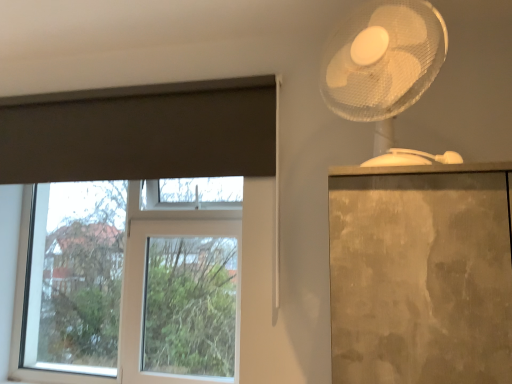
Question: Is white plastic fan at upper right completely or partially inside clear glass window at left?

Choices:
 (A) yes
 (B) no

Answer: (B)

Question: Is clear glass window at left to the left of white plastic fan at upper right from the viewer's perspective?

Choices:
 (A) yes
 (B) no

Answer: (A)

Question: Can you confirm if clear glass window at left is smaller than white plastic fan at upper right?

Choices:
 (A) yes
 (B) no

Answer: (B)

Question: Would you say clear glass window at left is a long distance from white plastic fan at upper right?

Choices:
 (A) yes
 (B) no

Answer: (A)

Question: Does clear glass window at left come behind white plastic fan at upper right?

Choices:
 (A) no
 (B) yes

Answer: (B)

Question: Considering their positions, is dark gray matte curtain at upper left located in front of or behind white plastic fan at upper right?

Choices:
 (A) front
 (B) behind

Answer: (B)

Question: Visually, is dark gray matte curtain at upper left positioned to the left or to the right of white plastic fan at upper right?

Choices:
 (A) right
 (B) left

Answer: (B)

Question: Is dark gray matte curtain at upper left inside the boundaries of white plastic fan at upper right, or outside?

Choices:
 (A) outside
 (B) inside

Answer: (A)

Question: In terms of width, does dark gray matte curtain at upper left look wider or thinner when compared to white plastic fan at upper right?

Choices:
 (A) thin
 (B) wide

Answer: (A)

Question: In terms of height, does white plastic fan at upper right look taller or shorter compared to clear glass window at left?

Choices:
 (A) tall
 (B) short

Answer: (B)

Question: Considering the positions of white plastic fan at upper right and clear glass window at left in the image, is white plastic fan at upper right bigger or smaller than clear glass window at left?

Choices:
 (A) small
 (B) big

Answer: (A)

Question: Choose the correct answer: Is white plastic fan at upper right inside clear glass window at left or outside it?

Choices:
 (A) outside
 (B) inside

Answer: (A)

Question: Does point (326, 66) appear closer or farther from the camera than point (45, 228)?

Choices:
 (A) closer
 (B) farther

Answer: (A)

Question: Based on their sizes in the image, would you say dark gray matte curtain at upper left is bigger or smaller than clear glass window at left?

Choices:
 (A) small
 (B) big

Answer: (A)

Question: Is dark gray matte curtain at upper left wider or thinner than clear glass window at left?

Choices:
 (A) wide
 (B) thin

Answer: (B)